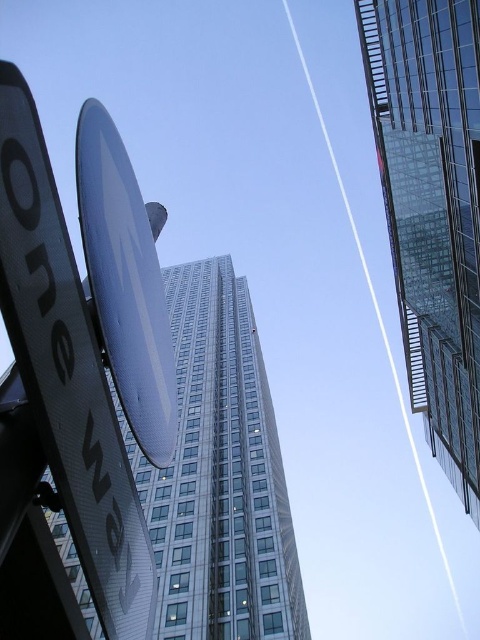
You are a city planner assessing the skyline. Which object in the image is significantly taller, the glassy reflective skyscraper at center or the metallic silver satellite dish at upper center?

The glassy reflective skyscraper at center is much taller than the metallic silver satellite dish at upper center.

You are a city planner analyzing this urban layout. You notice the glassy reflective skyscraper at center and the white glossy sign at upper left. Based on their positions, which object is located higher in the image?

The white glossy sign at upper left is located higher in the image than the glassy reflective skyscraper at center.